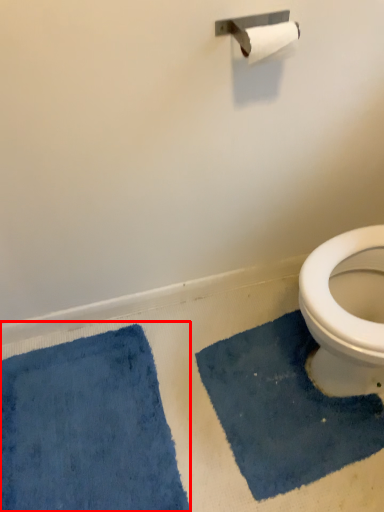
Question: Where is bath mat (annotated by the red box) located in relation to bath mat in the image?

Choices:
 (A) right
 (B) left

Answer: (B)